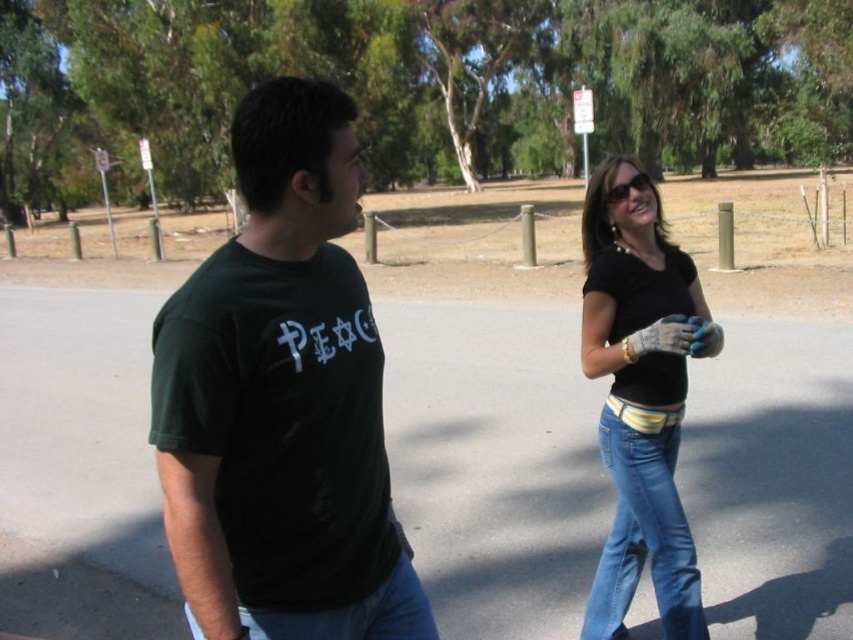
Which of these two, dark green t-shirt at left or blue denim jeans at lower left, stands shorter?

With less height is blue denim jeans at lower left.

This screenshot has height=640, width=853. Describe the element at coordinates (282, 401) in the screenshot. I see `dark green t-shirt at left` at that location.

Locate an element on the screen. The width and height of the screenshot is (853, 640). dark green t-shirt at left is located at coordinates (282, 401).

The image size is (853, 640). Find the location of `blue denim jeans at lower right`. blue denim jeans at lower right is located at coordinates (643, 525).

Can you confirm if blue denim jeans at lower right is positioned to the left of blue denim jeans at lower left?

In fact, blue denim jeans at lower right is to the right of blue denim jeans at lower left.

Is point (614, 417) farther from camera compared to point (430, 614)?

Yes, point (614, 417) is behind point (430, 614).

I want to click on blue denim jeans at lower right, so click(x=643, y=525).

Between dark green t-shirt at left and blue denim jeans at lower right, which one is positioned higher?

dark green t-shirt at left

Between dark green t-shirt at left and blue denim jeans at lower right, which one has less height?

Standing shorter between the two is blue denim jeans at lower right.

Describe the element at coordinates (282, 401) in the screenshot. I see `dark green t-shirt at left` at that location.

The image size is (853, 640). Identify the location of dark green t-shirt at left. (282, 401).